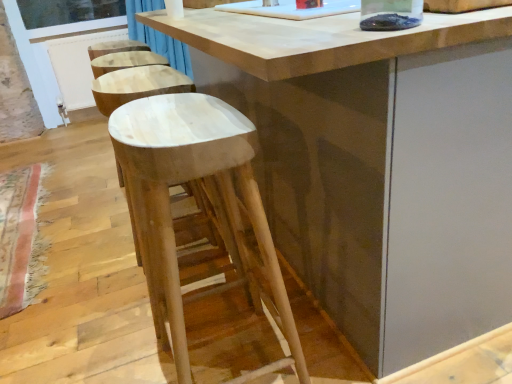
Question: Is white plastic screen door at left inside clear glass window screen at upper left?

Choices:
 (A) yes
 (B) no

Answer: (B)

Question: Does clear glass window screen at upper left lie in front of white plastic screen door at left?

Choices:
 (A) yes
 (B) no

Answer: (B)

Question: Is clear glass window screen at upper left positioned behind white plastic screen door at left?

Choices:
 (A) no
 (B) yes

Answer: (B)

Question: Does clear glass window screen at upper left have a larger size compared to white plastic screen door at left?

Choices:
 (A) no
 (B) yes

Answer: (A)

Question: Can we say clear glass window screen at upper left lies outside white plastic screen door at left?

Choices:
 (A) no
 (B) yes

Answer: (A)

Question: Is clear glass window screen at upper left facing towards white plastic screen door at left?

Choices:
 (A) yes
 (B) no

Answer: (A)

Question: Is natural wood table at center wider than clear glass window screen at upper left?

Choices:
 (A) yes
 (B) no

Answer: (A)

Question: From the image's perspective, is natural wood table at center under clear glass window screen at upper left?

Choices:
 (A) no
 (B) yes

Answer: (B)

Question: Is natural wood table at center shorter than clear glass window screen at upper left?

Choices:
 (A) no
 (B) yes

Answer: (A)

Question: Is the depth of natural wood table at center greater than that of clear glass window screen at upper left?

Choices:
 (A) no
 (B) yes

Answer: (A)

Question: Does natural wood table at center have a smaller size compared to clear glass window screen at upper left?

Choices:
 (A) no
 (B) yes

Answer: (A)

Question: Considering the relative positions of natural wood table at center and clear glass window screen at upper left in the image provided, is natural wood table at center in front of clear glass window screen at upper left?

Choices:
 (A) no
 (B) yes

Answer: (B)

Question: Is clear glass window screen at upper left aimed at natural wood stool at center?

Choices:
 (A) no
 (B) yes

Answer: (B)